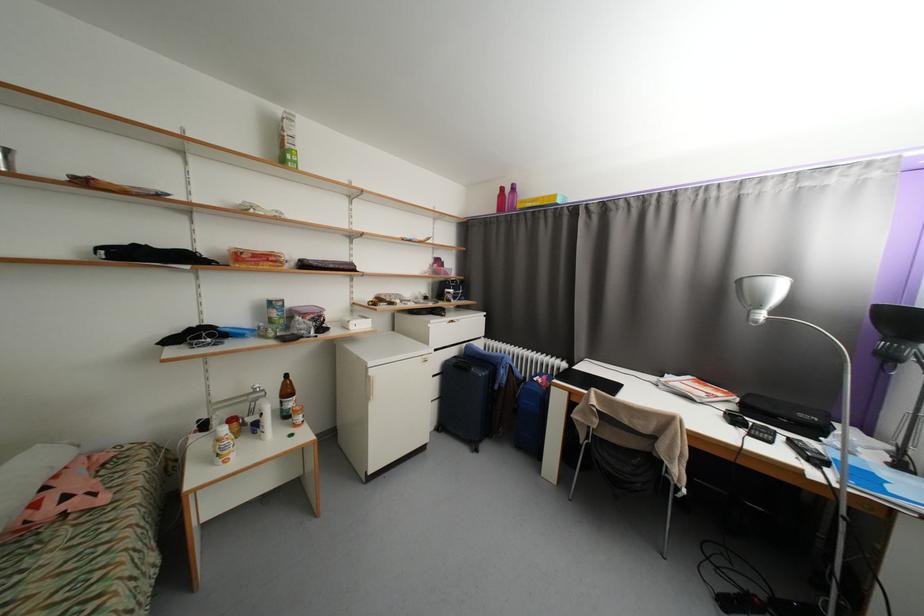
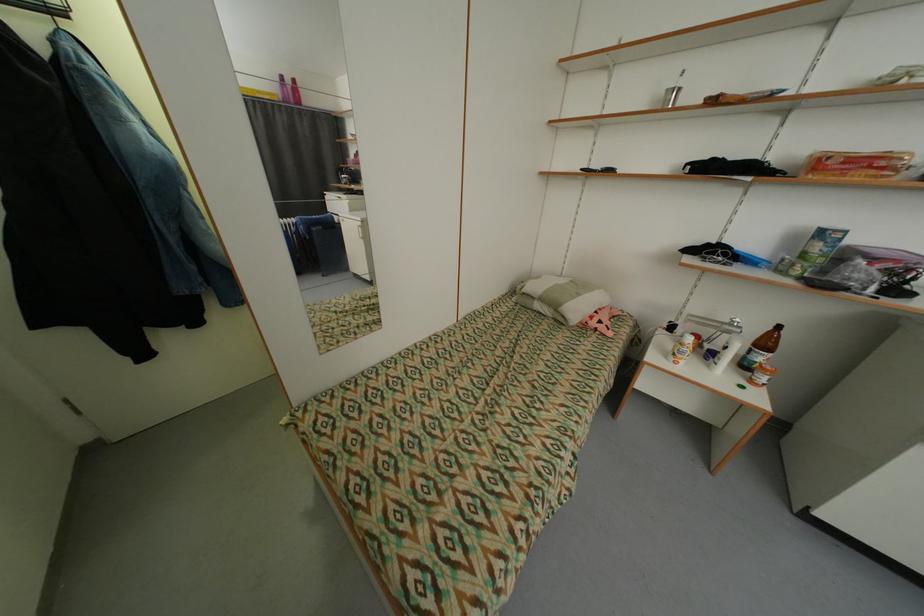
Locate, in the second image, the point that corresponds to point 265,439 in the first image.

(714, 367)